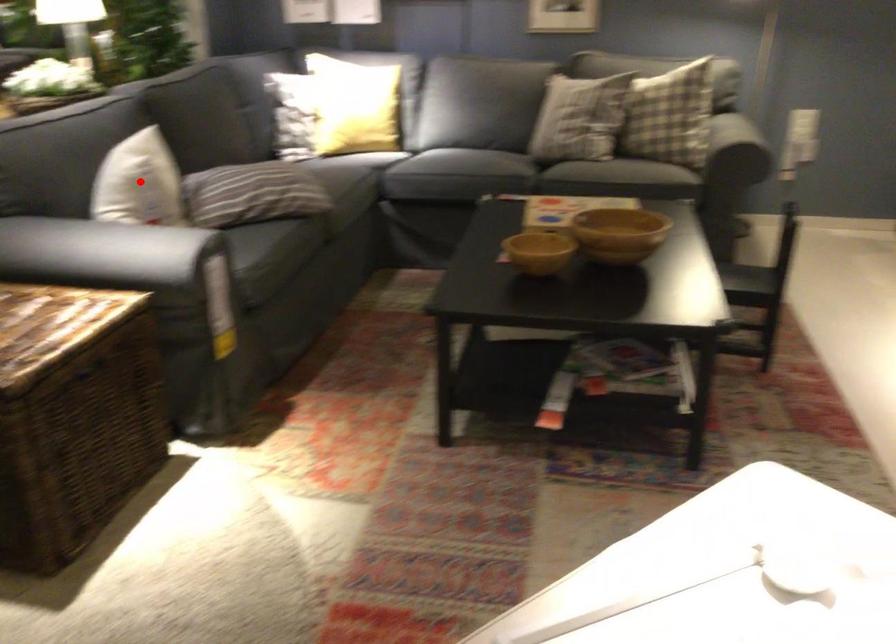
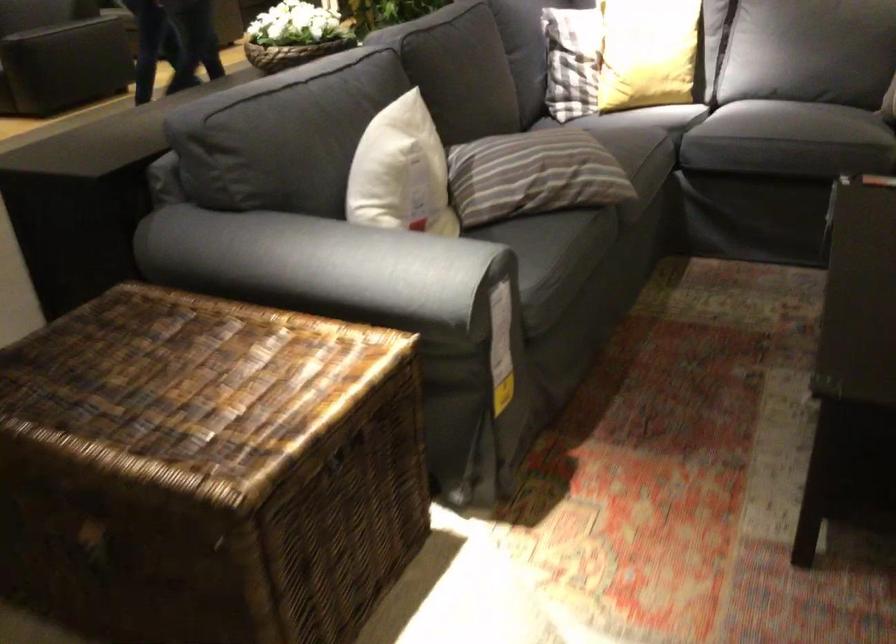
Question: I am providing you with two images of the same scene from different viewpoints. Image1 has a red point marked. In image2, the corresponding 3D location appears at what relative position? Reply with the corresponding letter.

Choices:
 (A) Closer
 (B) Farther

Answer: (A)